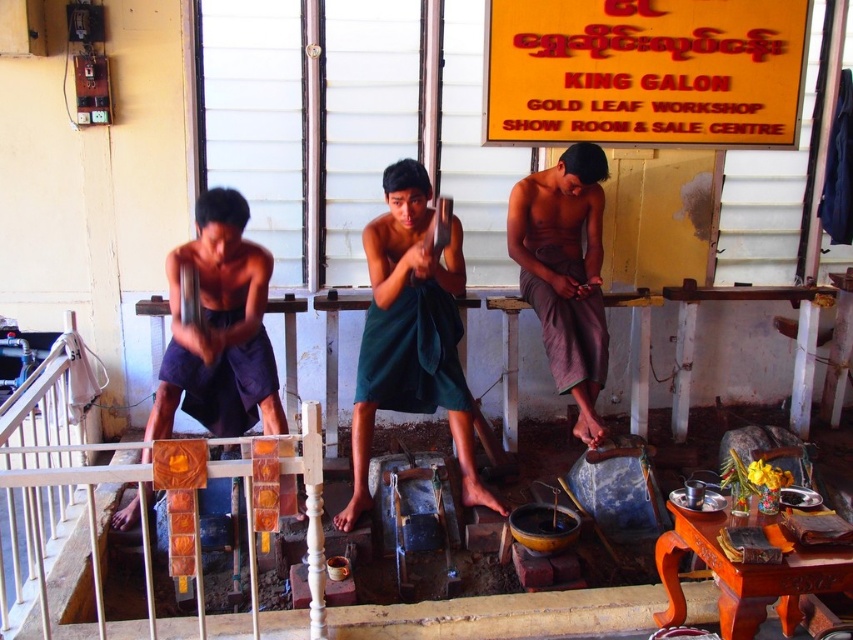
Who is taller, dark blue fabric at left or gray cotton pants at center?

gray cotton pants at center is taller.

Is point (280, 422) farther from viewer compared to point (553, 204)?

No, (280, 422) is closer to viewer.

Who is more forward, (265,339) or (592,195)?

Point (265,339) is in front.

This screenshot has width=853, height=640. Find the location of `dark blue fabric at left`. dark blue fabric at left is located at coordinates (219, 330).

Between green fabric at center and gray cotton pants at center, which one appears on the right side from the viewer's perspective?

Positioned to the right is gray cotton pants at center.

Does green fabric at center appear under gray cotton pants at center?

Correct, green fabric at center is located below gray cotton pants at center.

Where is `green fabric at center`? green fabric at center is located at coordinates (412, 333).

Consider the image. Does green fabric at center appear on the right side of dark blue fabric at left?

Yes, green fabric at center is to the right of dark blue fabric at left.

Who is positioned more to the left, green fabric at center or dark blue fabric at left?

dark blue fabric at left is more to the left.

Find the location of a particular element. Image resolution: width=853 pixels, height=640 pixels. green fabric at center is located at coordinates (412, 333).